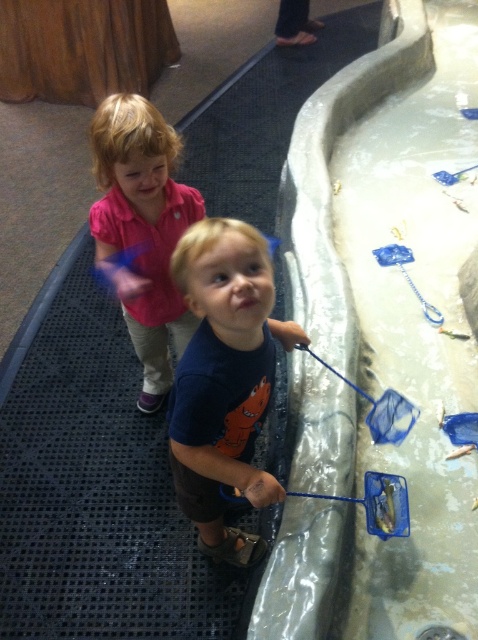
Does clear plastic water at upper right have a lesser height compared to blue cotton shirt at center?

No.

Which is behind, point (286, 596) or point (269, 499)?

The point (269, 499) is behind.

Is point (311, 608) closer to viewer compared to point (260, 260)?

That is False.

Identify the location of clear plastic water at upper right. The image size is (478, 640). (380, 333).

What do you see at coordinates (225, 378) in the screenshot?
I see `blue cotton shirt at center` at bounding box center [225, 378].

Which is more to the right, blue cotton shirt at center or pink cotton shirt at upper left?

blue cotton shirt at center is more to the right.

Describe the element at coordinates (225, 378) in the screenshot. I see `blue cotton shirt at center` at that location.

Locate an element on the screen. The height and width of the screenshot is (640, 478). blue cotton shirt at center is located at coordinates (225, 378).

Does clear plastic water at upper right come in front of pink cotton shirt at upper left?

Yes, it is.

Does point (448, 236) come behind point (121, 192)?

Yes.

Is point (393, 563) closer to viewer compared to point (160, 333)?

Yes, it is.

Identify the location of clear plastic water at upper right. The height and width of the screenshot is (640, 478). (380, 333).